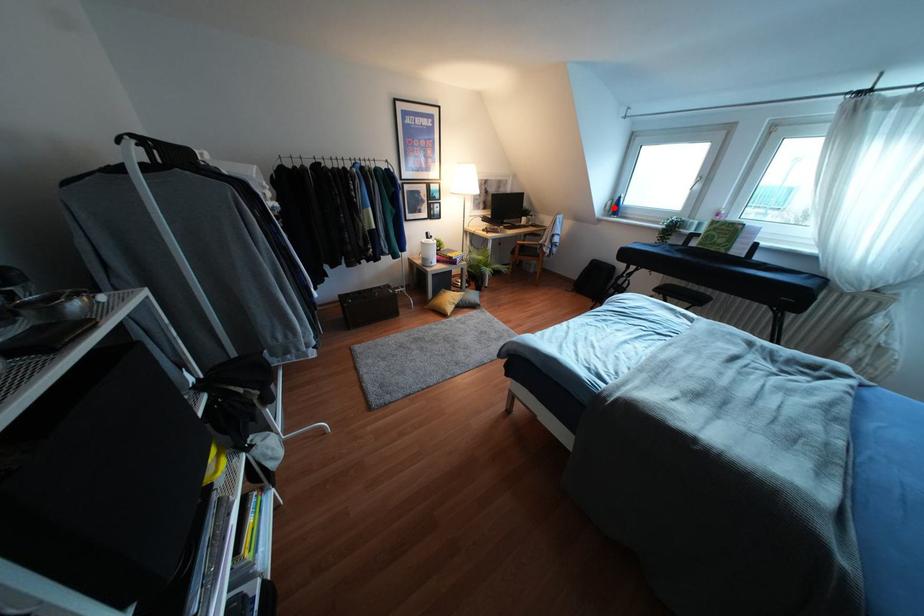
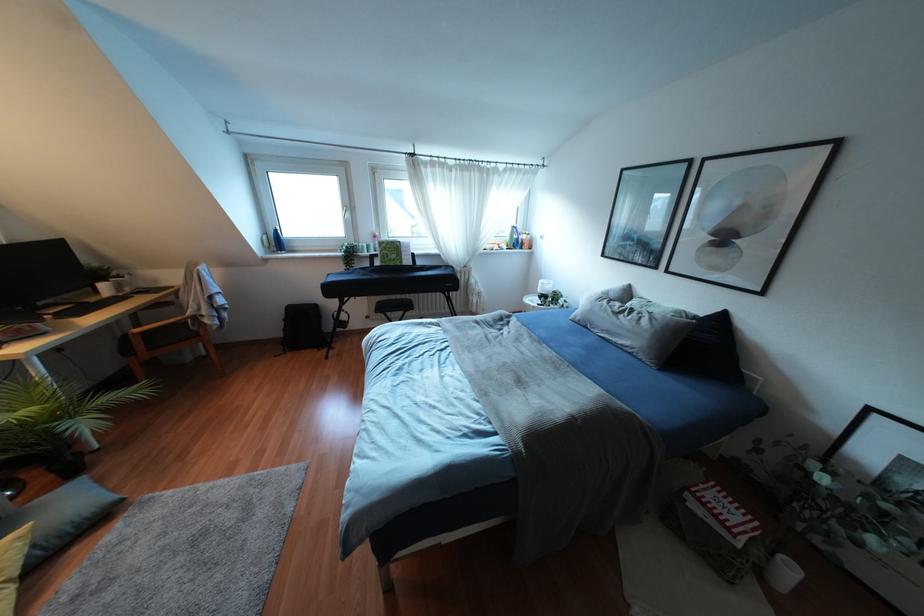
The point at the highlighted location is marked in the first image. Where is the corresponding point in the second image?

(275, 241)